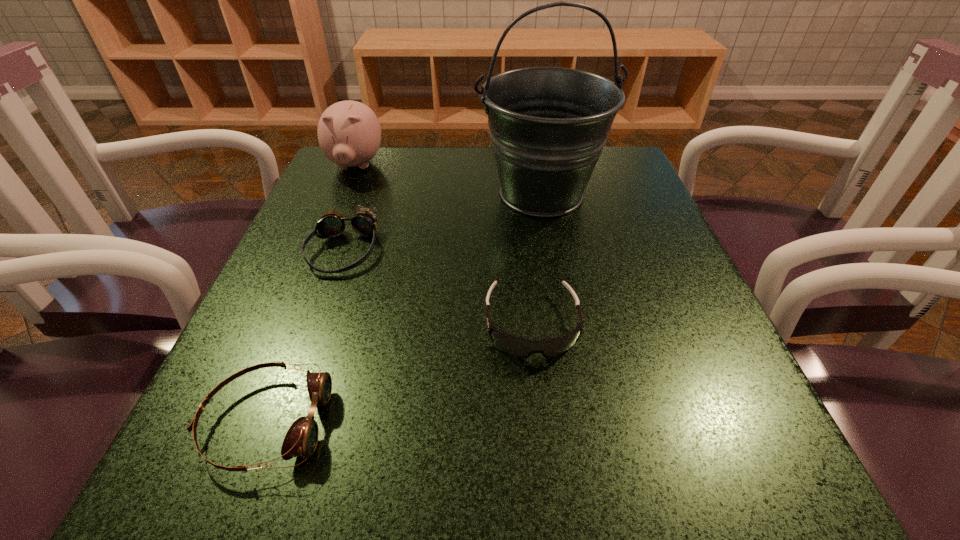
Locate an element on the screen. This screenshot has width=960, height=540. empty space that is in between the nearest object and the fourth shortest object is located at coordinates (311, 294).

Locate an element on the screen. free area in between the farthest goggles and the rightmost goggles is located at coordinates (438, 287).

Image resolution: width=960 pixels, height=540 pixels. I want to click on empty space between the second tallest object and the rightmost goggles, so click(x=444, y=245).

The width and height of the screenshot is (960, 540). I want to click on vacant area between the bucket and the rightmost goggles, so click(537, 259).

The height and width of the screenshot is (540, 960). Identify the location of vacant space that's between the nearest goggles and the farthest goggles. (304, 336).

Locate an element on the screen. This screenshot has height=540, width=960. object that is the third closest one to the tallest object is located at coordinates (349, 133).

Choose which object is the third nearest neighbor to the farthest goggles. Please provide its 2D coordinates. Your answer should be formatted as a tuple, i.e. [(x, y)], where the tuple contains the x and y coordinates of a point satisfying the conditions above.

[(301, 439)]

Select which goggles is the second closest to the rightmost goggles. Please provide its 2D coordinates. Your answer should be formatted as a tuple, i.e. [(x, y)], where the tuple contains the x and y coordinates of a point satisfying the conditions above.

[(301, 439)]

Locate an element on the screen. goggles that is the second closest to the farthest goggles is located at coordinates (522, 347).

This screenshot has height=540, width=960. I want to click on free space that satisfies the following two spatial constraints: 1. at the snout of the tallest object; 2. on the left side of the piggy bank, so click(x=344, y=194).